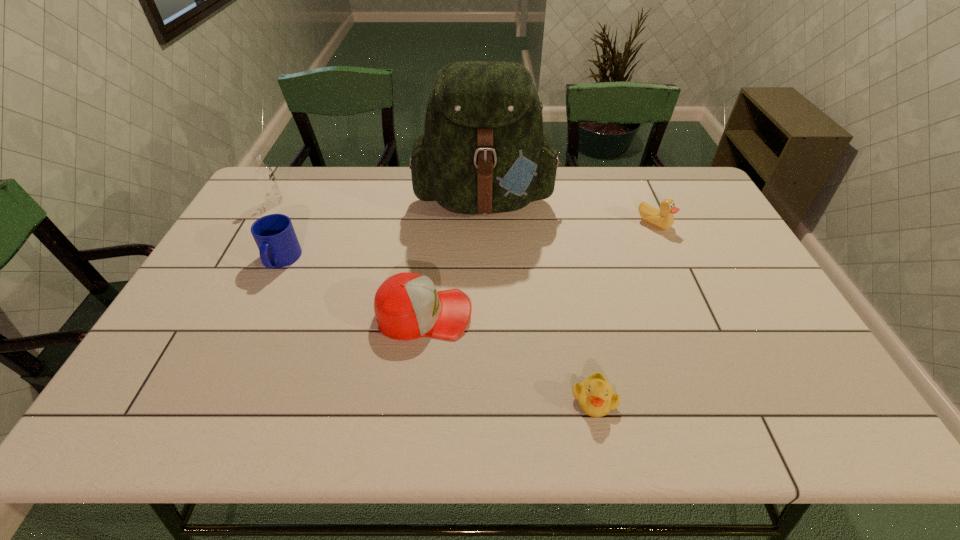
The width and height of the screenshot is (960, 540). What are the coordinates of `vacant space in between the tallest object and the fifth object from right to left` in the screenshot? It's located at (383, 230).

Where is `free space between the second tallest object and the backpack`? Image resolution: width=960 pixels, height=540 pixels. free space between the second tallest object and the backpack is located at coordinates (380, 200).

Locate an element on the screen. Image resolution: width=960 pixels, height=540 pixels. unoccupied area between the fifth shortest object and the backpack is located at coordinates (380, 200).

You are a GUI agent. You are given a task and a screenshot of the screen. Output one action in this format:
    pyautogui.click(x=<x>, y=<y>)
    Task: Click on the free space between the rightmost object and the backpack
    The image size is (960, 540).
    Given the screenshot: What is the action you would take?
    pyautogui.click(x=569, y=211)

The image size is (960, 540). I want to click on vacant space that is in between the fifth farthest object and the tallest object, so click(x=455, y=256).

Find the location of `object that is the third closest to the backpack`. object that is the third closest to the backpack is located at coordinates (278, 245).

Find the location of a particular element. The width and height of the screenshot is (960, 540). object that is the second closest to the nearest object is located at coordinates (483, 151).

At what (x,y) coordinates should I click in order to perform the action: click on vacant position in the image that satisfies the following two spatial constraints: 1. on the open flap of the tallest object; 2. on the front-facing side of the second nearest object. Please return your answer as a coordinate pair (x, y). Looking at the image, I should click on (487, 314).

The width and height of the screenshot is (960, 540). Identify the location of free region that satisfies the following two spatial constraints: 1. at the beak of the rightmost object; 2. on the front-facing side of the second nearest object. (695, 314).